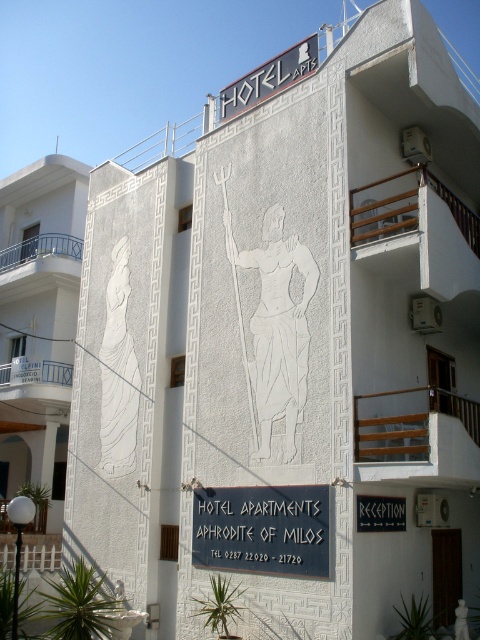
Identify the location of white plastic sign at upper center. (268, 77).

Does point (288, 68) come in front of point (383, 529)?

No.

You are a GUI agent. You are given a task and a screenshot of the screen. Output one action in this format:
    pyautogui.click(x=<x>, y=<y>)
    Task: Click on the white plastic sign at upper center
    This screenshot has width=480, height=640.
    Given the screenshot: What is the action you would take?
    pyautogui.click(x=268, y=77)

Identify the location of white plastic sign at upper center. This screenshot has height=640, width=480. (268, 77).

Who is lower down, black metal signboard at center or black matte sign at center?

black metal signboard at center is below.

Can you confirm if black metal signboard at center is positioned below black matte sign at center?

Correct, black metal signboard at center is located below black matte sign at center.

Between point (222, 554) and point (361, 499), which one is positioned behind?

Point (222, 554)

At what (x,y) coordinates should I click in order to perform the action: click on black metal signboard at center. Please return your answer as a coordinate pair (x, y). Looking at the image, I should click on click(x=262, y=529).

Can you confirm if black metal signboard at center is bigger than white plastic sign at upper center?

No.

This screenshot has width=480, height=640. In order to click on black metal signboard at center in this screenshot , I will do `click(262, 529)`.

Locate an element on the screen. black metal signboard at center is located at coordinates (262, 529).